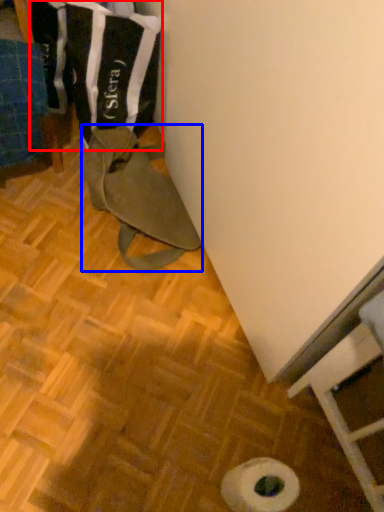
Question: Among these objects, which one is farthest to the camera, laundry (highlighted by a red box) or wide (highlighted by a blue box)?

Choices:
 (A) laundry
 (B) wide

Answer: (B)